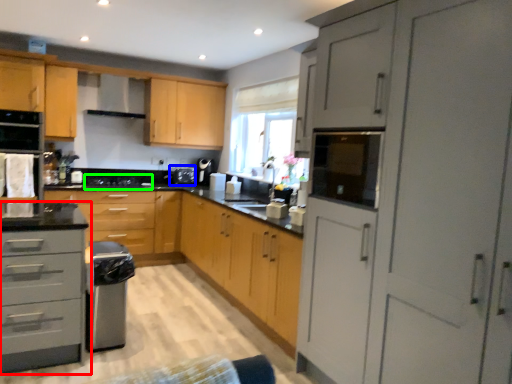
Question: Which object is the farthest from cabinetry (highlighted by a red box)? Choose among these: appliance (highlighted by a blue box) or gas stove (highlighted by a green box).

Choices:
 (A) appliance
 (B) gas stove

Answer: (A)